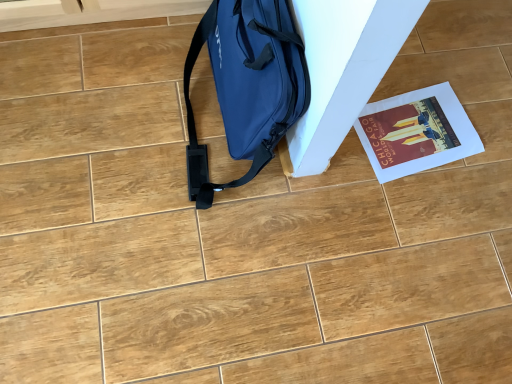
At what (x,y) coordinates should I click in order to perform the action: click on empty space that is to the right of matte paper poster at lower right. Please return your answer as a coordinate pair (x, y). This screenshot has width=512, height=384. Looking at the image, I should click on (488, 159).